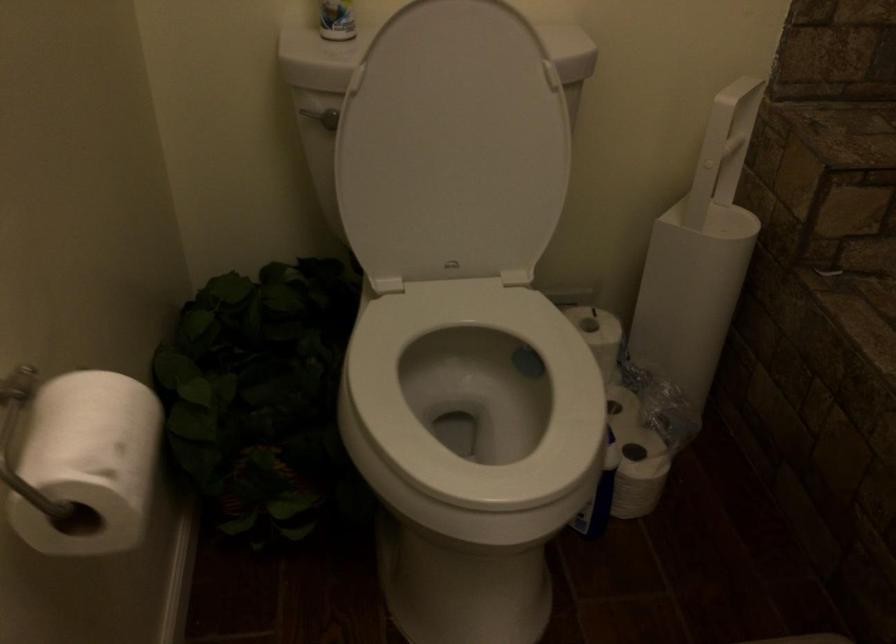
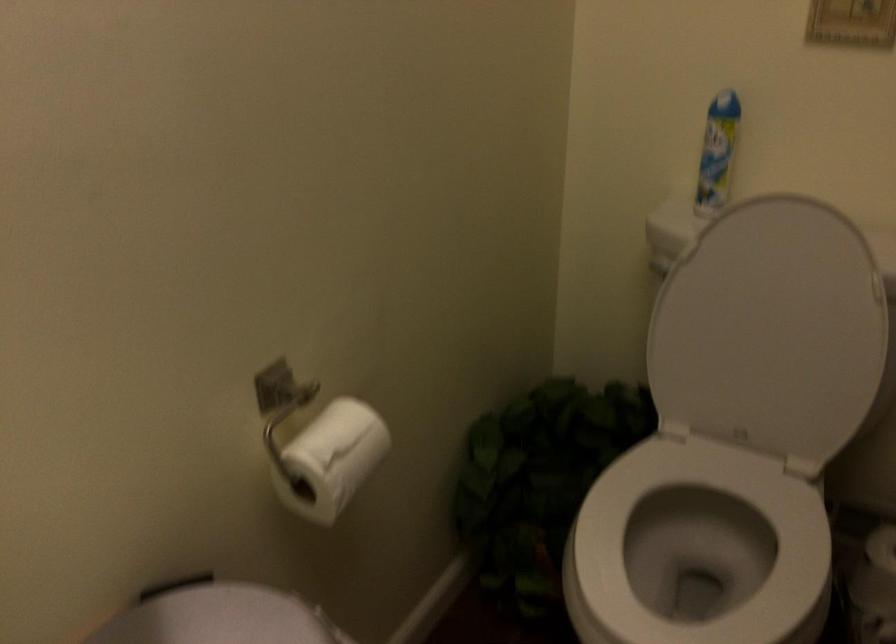
The point at (444, 393) is marked in the first image. Where is the corresponding point in the second image?

(698, 547)